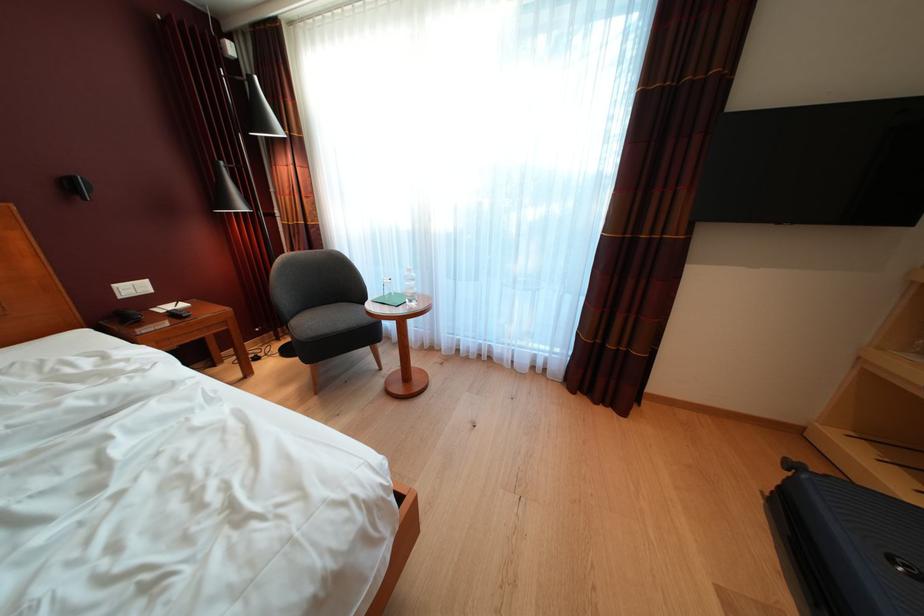
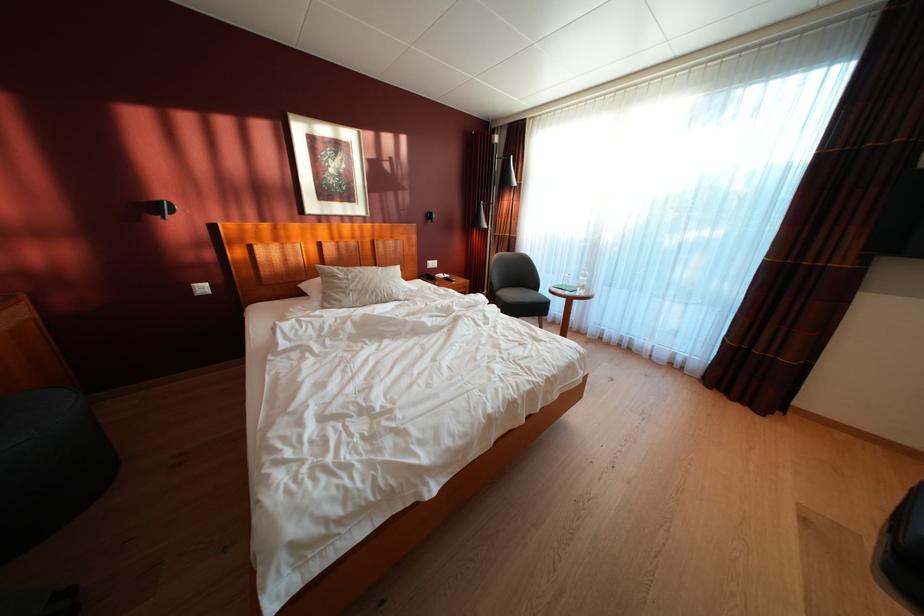
Question: Which direction would the cameraman need to move to produce the second image? Reply with the corresponding letter.

Choices:
 (A) Left
 (B) Right
 (C) Forward
 (D) Backward

Answer: (D)